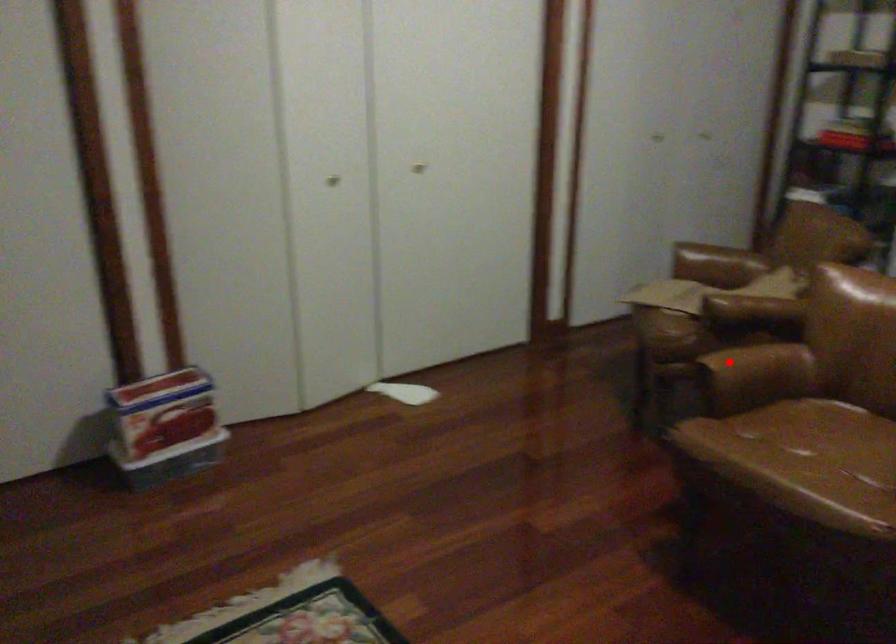
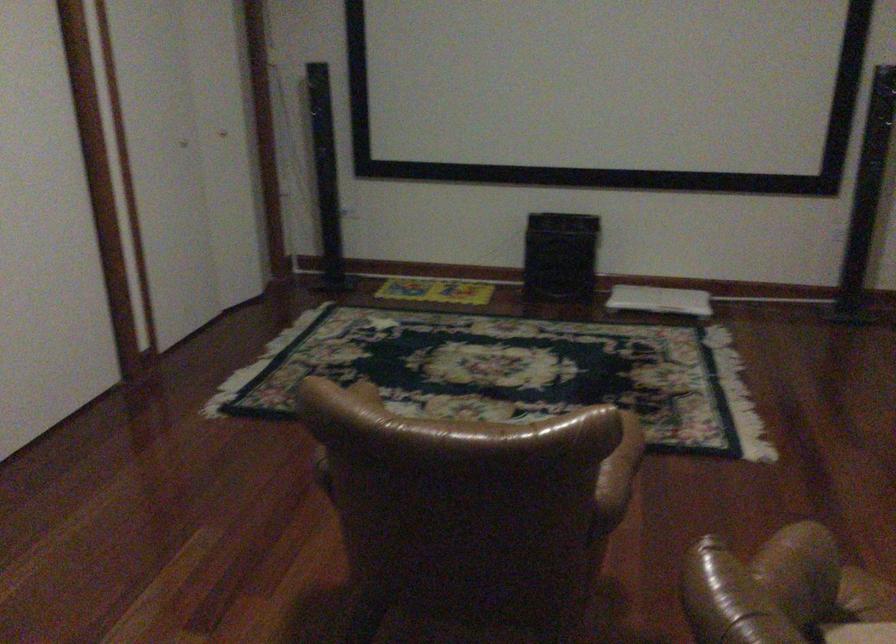
Question: I am providing you with two images of the same scene from different viewpoints. In image1, a red point is highlighted. Considering the same 3D point in image2, which of the following is correct?

Choices:
 (A) It is closer
 (B) It is farther

Answer: (A)